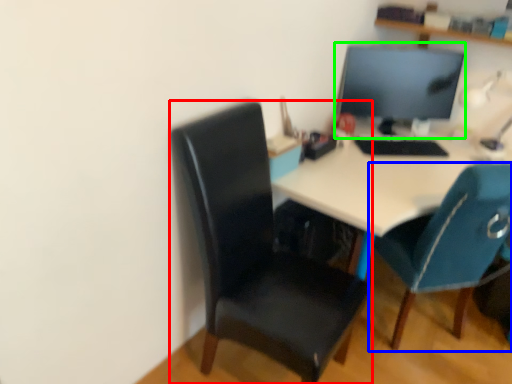
Question: Which object is positioned closest to chair (highlighted by a red box)? Select from chair (highlighted by a blue box) and computer monitor (highlighted by a green box).

Choices:
 (A) chair
 (B) computer monitor

Answer: (A)